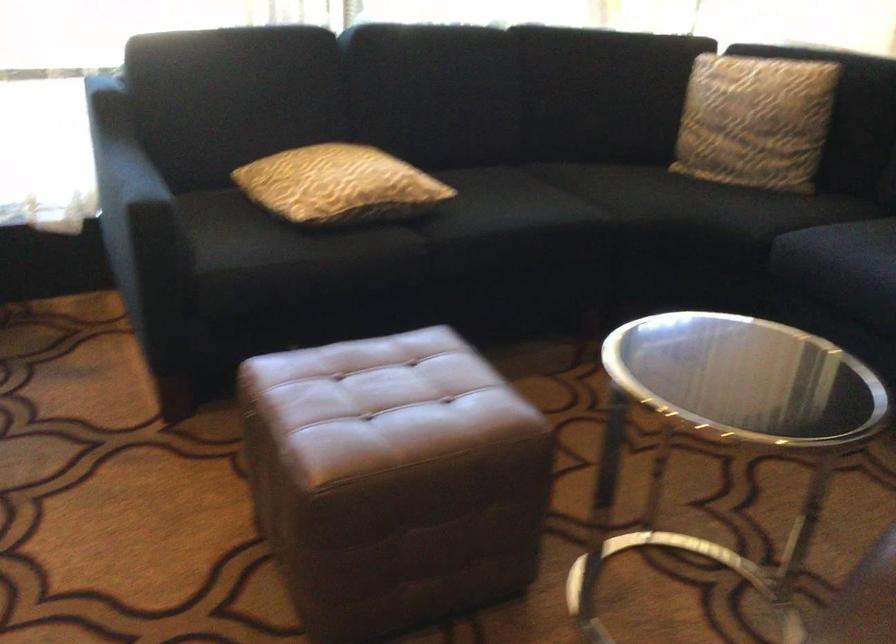
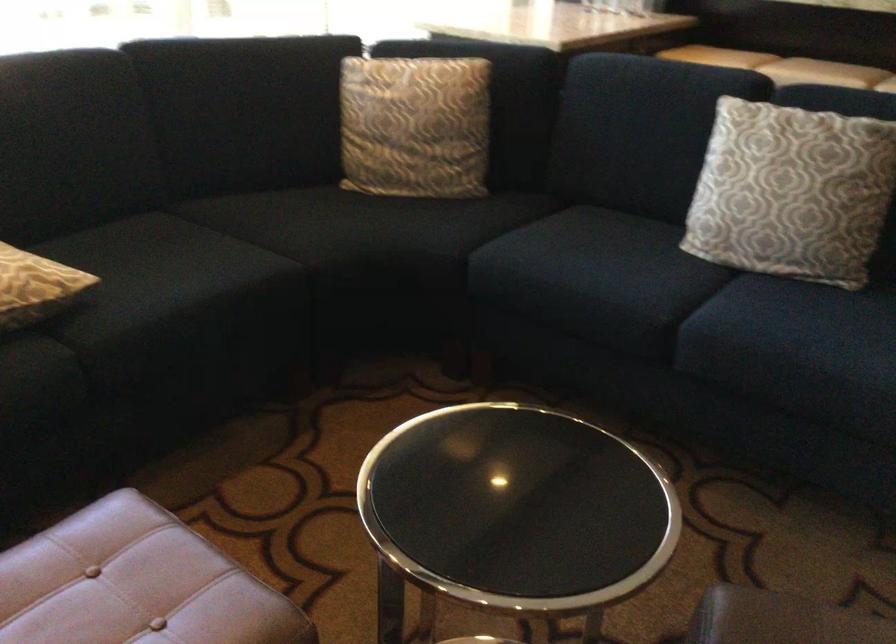
Find the pixel in the second image that matches pixel 593 90 in the first image.

(238, 111)